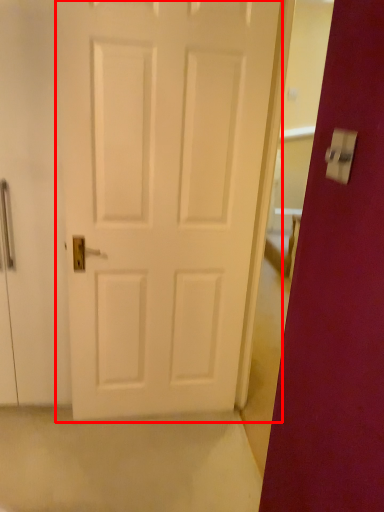
Question: In this image, where is door (annotated by the red box) located relative to light switch?

Choices:
 (A) right
 (B) left

Answer: (B)